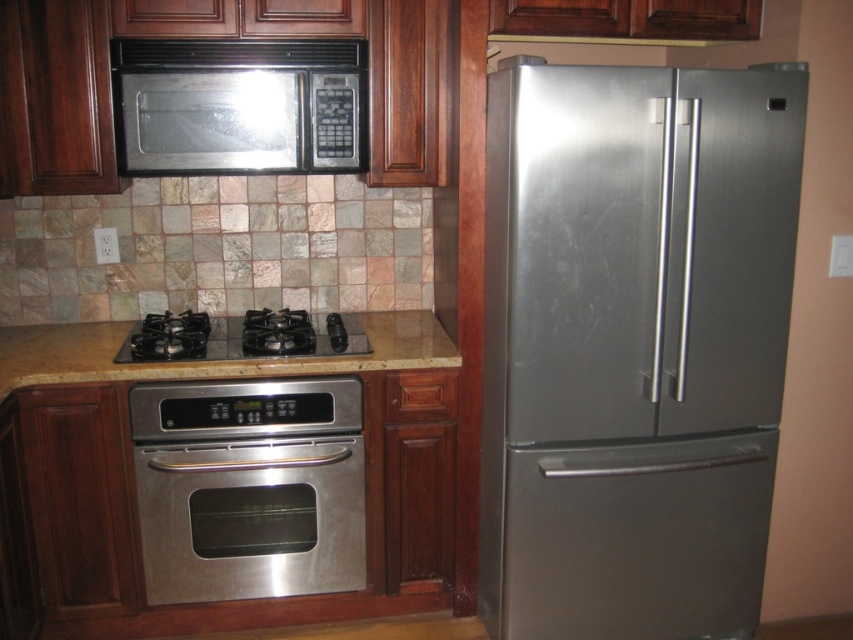
You are a chef preparing to install a new ventilation system. The ventilation system requires a minimum of 30 inches of space between the countertop and the exhaust hood. Based on the image, will the current distance between the beige marble countertop at center and the black matte exhaust hood at upper center meet the requirement?

The distance between the beige marble countertop at center and the black matte exhaust hood at upper center is 32.94 inches, which exceeds the required 30 inches. Therefore, the current distance meets the ventilation system requirement.

You are moving a 90 cm wide pizza into the kitchen. You need to slide it between the stainless steel refrigerator at right and the stainless steel microwave at upper center. Can it fit through the space between them?

The distance between the stainless steel refrigerator at right and the stainless steel microwave at upper center is 86.90 centimeters. Since the pizza is 90 cm wide, it cannot fit through the space between them.